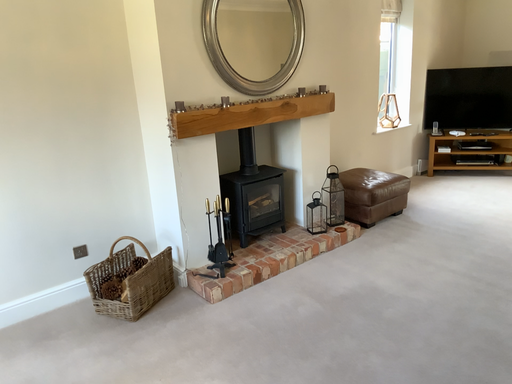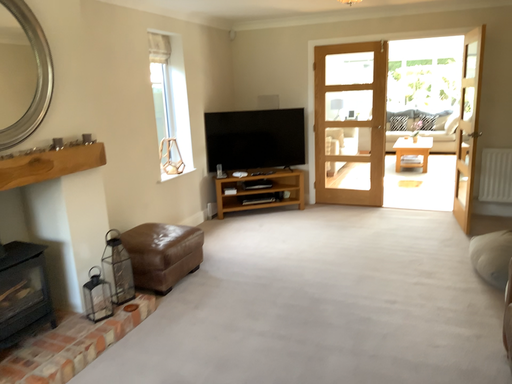
Question: Which way did the camera rotate in the video?

Choices:
 (A) rotated right
 (B) rotated left

Answer: (A)